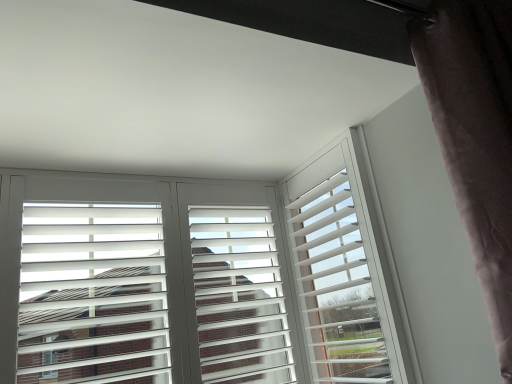
Question: Considering the relative sizes of dark velvet curtain at right and white matte window frame at center in the image provided, is dark velvet curtain at right smaller than white matte window frame at center?

Choices:
 (A) yes
 (B) no

Answer: (B)

Question: From a real-world perspective, is dark velvet curtain at right beneath white matte window frame at center?

Choices:
 (A) no
 (B) yes

Answer: (A)

Question: Is dark velvet curtain at right outside white matte window frame at center?

Choices:
 (A) yes
 (B) no

Answer: (A)

Question: From the image's perspective, is dark velvet curtain at right on white matte window frame at center?

Choices:
 (A) yes
 (B) no

Answer: (A)

Question: From a real-world perspective, is dark velvet curtain at right on top of white matte window frame at center?

Choices:
 (A) yes
 (B) no

Answer: (A)

Question: Visually, is dark velvet curtain at right positioned to the left or to the right of white matte shutters at center?

Choices:
 (A) left
 (B) right

Answer: (B)

Question: In terms of size, does dark velvet curtain at right appear bigger or smaller than white matte shutters at center?

Choices:
 (A) small
 (B) big

Answer: (B)

Question: From a real-world perspective, is dark velvet curtain at right positioned above or below white matte shutters at center?

Choices:
 (A) below
 (B) above

Answer: (B)

Question: Considering the positions of dark velvet curtain at right and white matte shutters at center in the image, is dark velvet curtain at right taller or shorter than white matte shutters at center?

Choices:
 (A) short
 (B) tall

Answer: (B)

Question: Based on their sizes in the image, would you say white matte window frame at center is bigger or smaller than dark velvet curtain at right?

Choices:
 (A) big
 (B) small

Answer: (B)

Question: Would you say white matte window frame at center is to the left or to the right of dark velvet curtain at right in the picture?

Choices:
 (A) right
 (B) left

Answer: (B)

Question: In the image, is white matte window frame at center positioned in front of or behind dark velvet curtain at right?

Choices:
 (A) front
 (B) behind

Answer: (B)

Question: Is white matte window frame at center spatially inside dark velvet curtain at right, or outside of it?

Choices:
 (A) outside
 (B) inside

Answer: (A)

Question: In the image, is white matte window frame at center positioned in front of or behind white matte shutters at center?

Choices:
 (A) front
 (B) behind

Answer: (B)

Question: In terms of width, does white matte window frame at center look wider or thinner when compared to white matte shutters at center?

Choices:
 (A) thin
 (B) wide

Answer: (B)